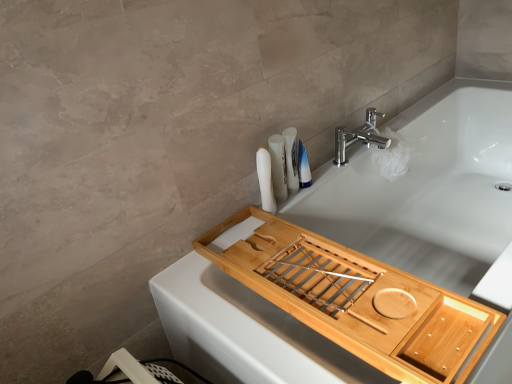
This screenshot has width=512, height=384. What are the coordinates of `vacant area on top of natural wood tray at upper right (from a real-world perspective)` in the screenshot? It's located at point(324,274).